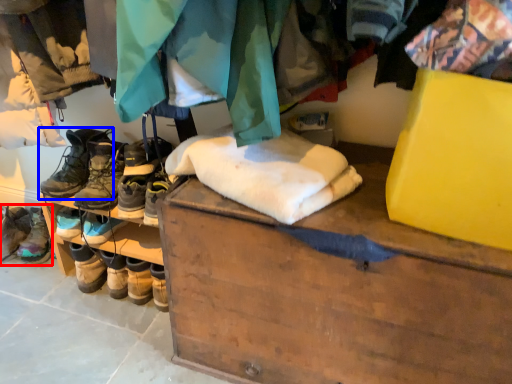
Question: Which object appears farthest to the camera in this image, footwear (highlighted by a red box) or footwear (highlighted by a blue box)?

Choices:
 (A) footwear
 (B) footwear

Answer: (A)